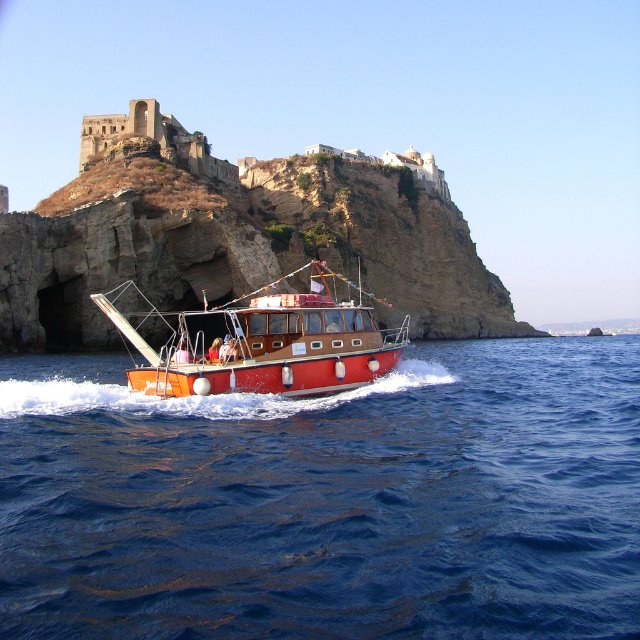
You are standing on a cliff overlooking the sea and see the blue liquid water at center and the shiny red boat at center. Which object is nearer to you?

The blue liquid water at center is closer to the viewer than the shiny red boat at center.

You are a passenger on the shiny red boat at center. You want to know if you can see the blue liquid water at center from your current position. Can you?

The blue liquid water at center has a lesser height compared to shiny red boat at center, so yes, you can see the blue liquid water at center from your current position because it is lower than the boat.